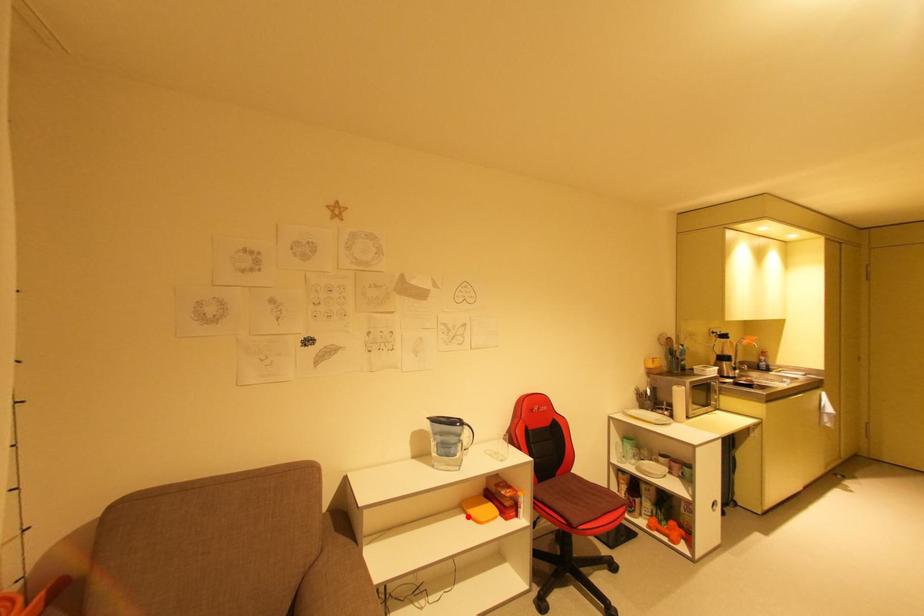
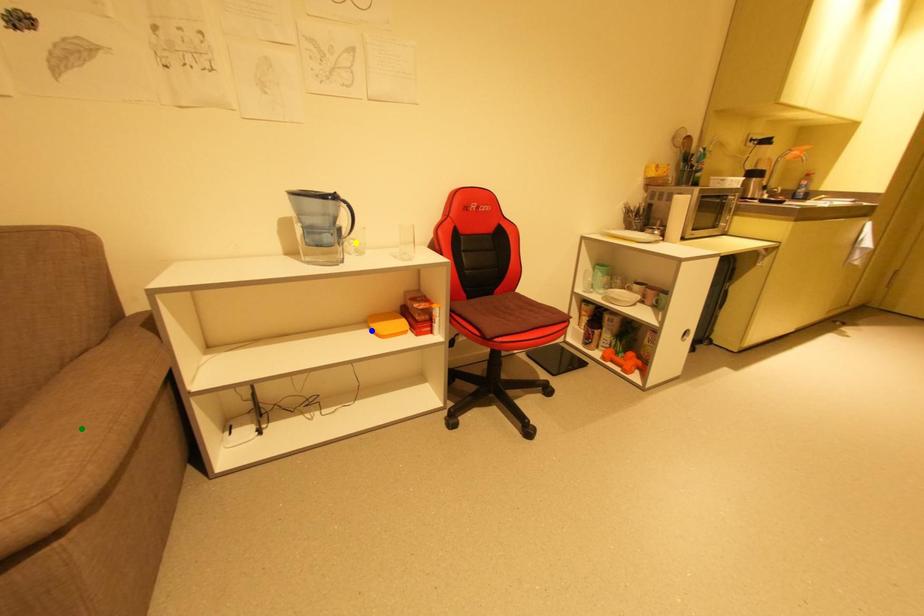
Question: I am providing you with two images of the same scene from different viewpoints. A red point is marked on the first image. You are given multiple points on the second image. Which mark in image 2 goes with the point in image 1?

Choices:
 (A) green point
 (B) yellow point
 (C) blue point

Answer: (C)